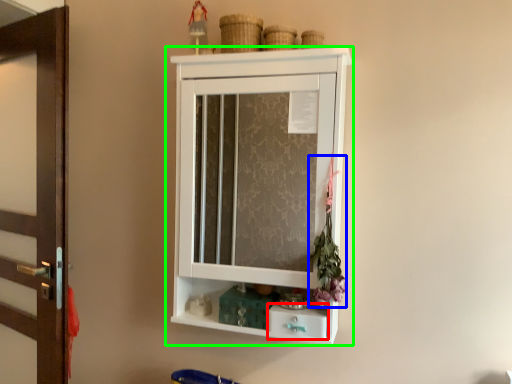
Question: Estimate the real-world distances between objects in this image. Which object is closer to drawer (highlighted by a red box), flower (highlighted by a blue box) or cupboard (highlighted by a green box)?

Choices:
 (A) flower
 (B) cupboard

Answer: (A)